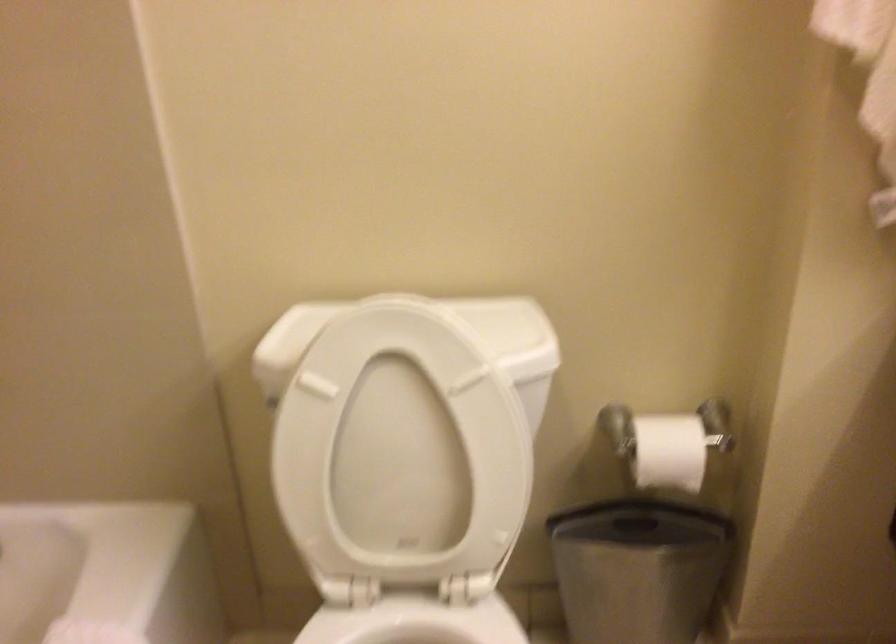
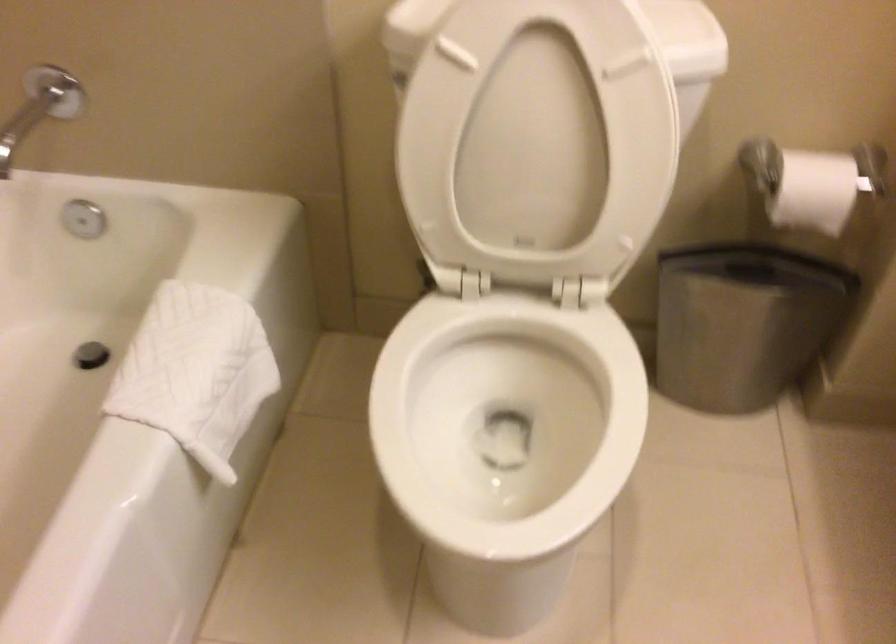
Where in the second image is the point corresponding to pixel 668 451 from the first image?

(812, 183)